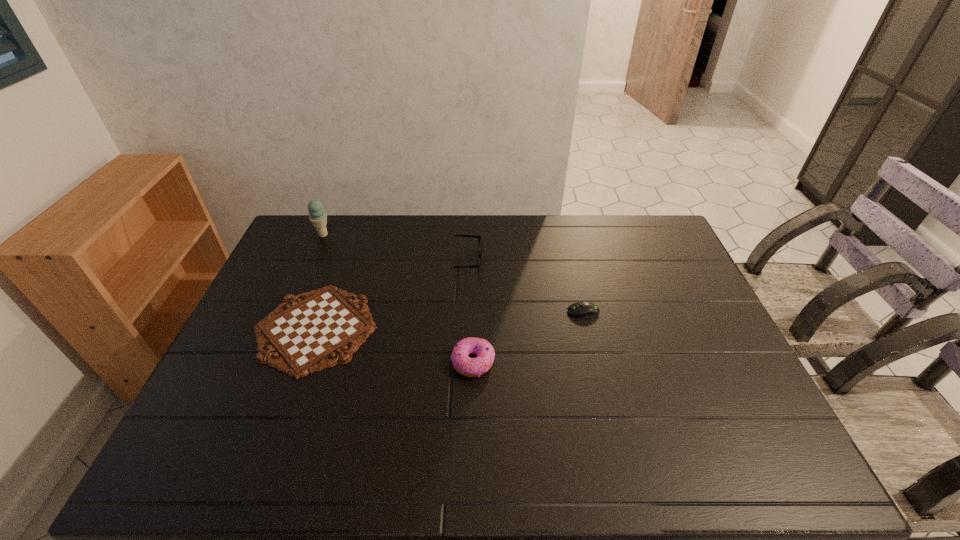
Find the location of a particular element. This screenshot has height=540, width=960. vacant space positioned on the front of the doughnut is located at coordinates (472, 422).

You are a GUI agent. You are given a task and a screenshot of the screen. Output one action in this format:
    pyautogui.click(x=<x>, y=<y>)
    Task: Click on the vacant space situated on the wheel side of the computer mouse
    The height and width of the screenshot is (540, 960).
    Given the screenshot: What is the action you would take?
    pyautogui.click(x=488, y=312)

At what (x,y) coordinates should I click in order to perform the action: click on free location located on the wheel side of the computer mouse. Please return your answer as a coordinate pair (x, y). Looking at the image, I should click on (448, 312).

I want to click on vacant space located on the wheel side of the computer mouse, so click(x=515, y=312).

Where is `vacant space situated 0.370m on the right of the shortest object`? The image size is (960, 540). vacant space situated 0.370m on the right of the shortest object is located at coordinates (504, 328).

Where is `ice cream that is positioned at the far edge`? This screenshot has width=960, height=540. ice cream that is positioned at the far edge is located at coordinates (318, 217).

Image resolution: width=960 pixels, height=540 pixels. I want to click on spectacles at the far edge, so click(x=480, y=250).

At what (x,y) coordinates should I click in order to perform the action: click on ice cream at the left edge. Please return your answer as a coordinate pair (x, y). Image resolution: width=960 pixels, height=540 pixels. Looking at the image, I should click on (318, 217).

Identify the location of chessboard present at the left edge. This screenshot has width=960, height=540. (304, 335).

You are a GUI agent. You are given a task and a screenshot of the screen. Output one action in this format:
    pyautogui.click(x=<x>, y=<y>)
    Task: Click on the object at the far left corner
    Image resolution: width=960 pixels, height=540 pixels.
    Given the screenshot: What is the action you would take?
    pyautogui.click(x=318, y=217)